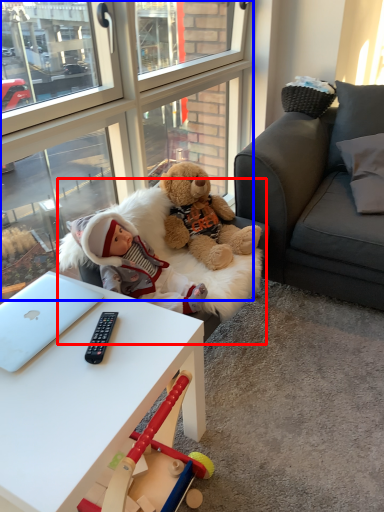
Question: Which object is further to the camera taking this photo, swivel chair (highlighted by a red box) or glass door (highlighted by a blue box)?

Choices:
 (A) swivel chair
 (B) glass door

Answer: (A)